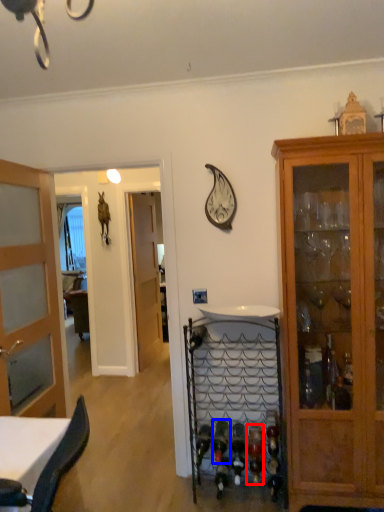
Question: Which point is further to the camera, wine bottle (highlighted by a red box) or wine bottle (highlighted by a blue box)?

Choices:
 (A) wine bottle
 (B) wine bottle

Answer: (B)